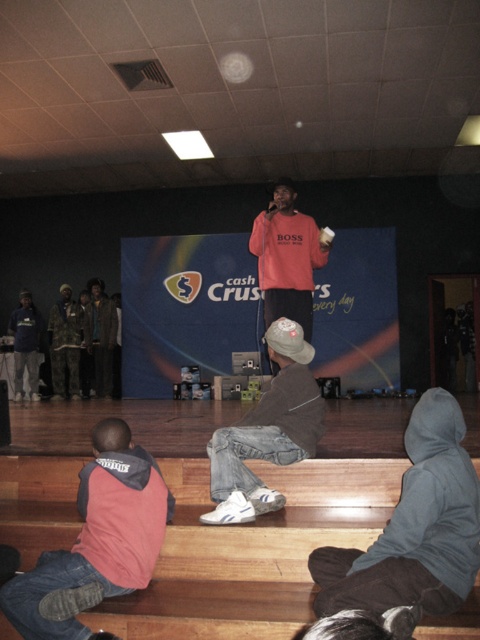
Question: Among these objects, which one is farthest from the camera?

Choices:
 (A) matte pink sweatshirt at center
 (B) pink fleece vest at lower left
 (C) wooden floor at lower center

Answer: (A)

Question: Which of the following is the farthest from the observer?

Choices:
 (A) denim jeans at center
 (B) matte pink sweatshirt at center
 (C) pink fleece vest at lower left

Answer: (B)

Question: Is denim jeans at center to the left of matte pink sweatshirt at center from the viewer's perspective?

Choices:
 (A) yes
 (B) no

Answer: (A)

Question: Can you confirm if pink fleece vest at lower left is positioned above denim jeans at center?

Choices:
 (A) no
 (B) yes

Answer: (A)

Question: Estimate the real-world distances between objects in this image. Which object is farther from the denim jeans at center?

Choices:
 (A) matte pink sweatshirt at center
 (B) wooden floor at lower center

Answer: (A)

Question: Is wooden floor at lower center in front of matte pink sweatshirt at center?

Choices:
 (A) no
 (B) yes

Answer: (B)